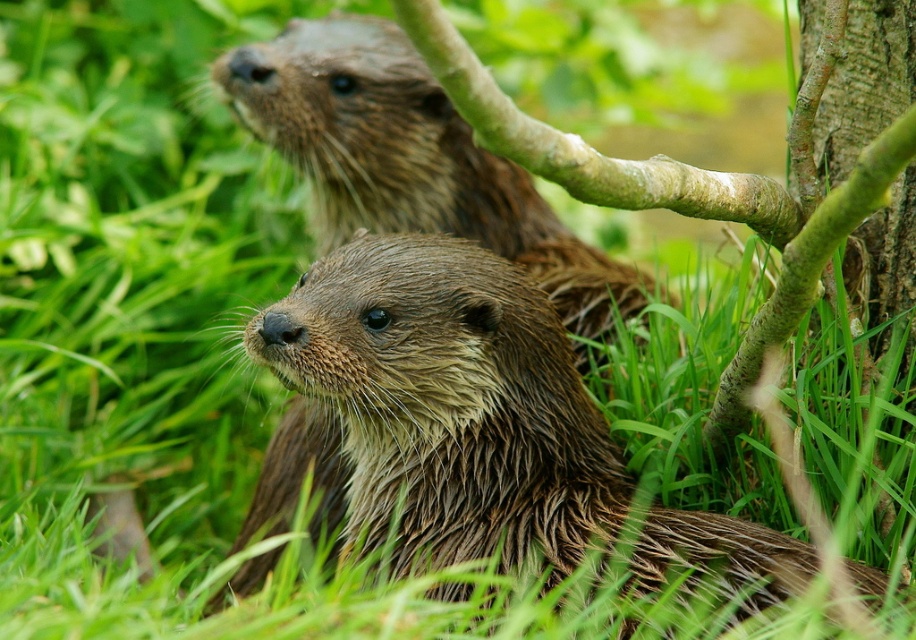
Question: Among these points, which one is farthest from the camera?

Choices:
 (A) (521, 198)
 (B) (439, 484)

Answer: (A)

Question: Which object is farther from the camera taking this photo?

Choices:
 (A) wet fur otter at center
 (B) brown wet fur otter at upper center

Answer: (B)

Question: Can you confirm if wet fur otter at center is positioned to the right of brown wet fur otter at upper center?

Choices:
 (A) yes
 (B) no

Answer: (A)

Question: Does wet fur otter at center have a larger size compared to brown wet fur otter at upper center?

Choices:
 (A) no
 (B) yes

Answer: (A)

Question: Does wet fur otter at center come behind brown wet fur otter at upper center?

Choices:
 (A) no
 (B) yes

Answer: (A)